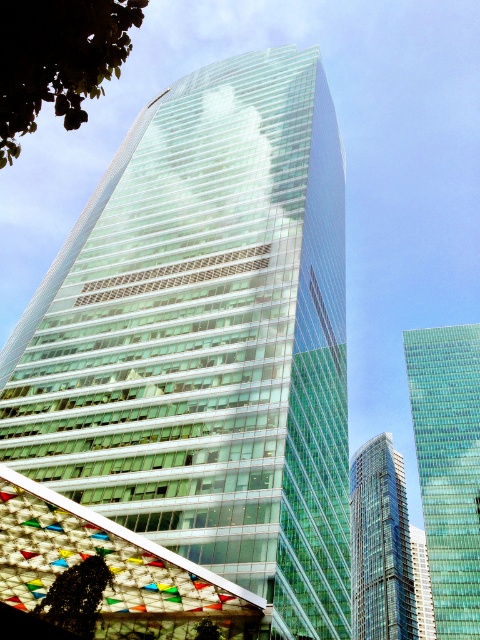
Question: Observing the image, what is the correct spatial positioning of transparent glass skyscraper at upper center in reference to glassy blue skyscraper at center?

Choices:
 (A) below
 (B) above

Answer: (B)

Question: Considering the relative positions of green leafy tree at upper left and green leafy tree at lower left in the image provided, where is green leafy tree at upper left located with respect to green leafy tree at lower left?

Choices:
 (A) below
 (B) above

Answer: (B)

Question: Which object is closer to the camera taking this photo?

Choices:
 (A) transparent glass skyscraper at upper center
 (B) green leafy tree at lower center
 (C) green leafy tree at lower left

Answer: (C)

Question: Is green leafy tree at upper left thinner than green leafy tree at lower center?

Choices:
 (A) no
 (B) yes

Answer: (A)

Question: Based on their relative distances, which object is farther from the green leafy tree at lower left?

Choices:
 (A) transparent glass skyscraper at upper center
 (B) green leafy tree at upper left

Answer: (A)

Question: Which object appears closest to the camera in this image?

Choices:
 (A) glassy blue skyscraper at center
 (B) transparent glass building at center

Answer: (B)